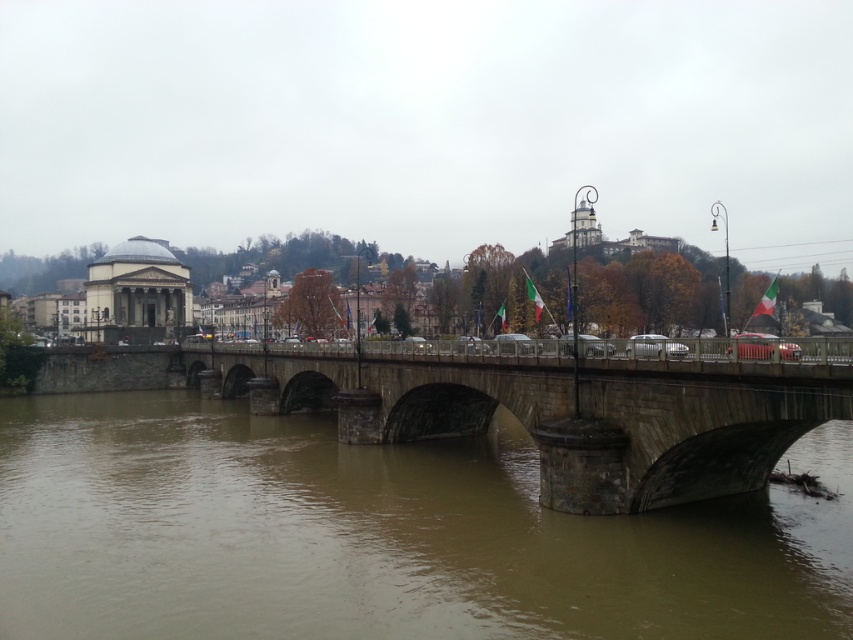
Consider the image. Is brown stone river at center positioned before stone bridge at center?

Yes.

Can you confirm if brown stone river at center is taller than stone bridge at center?

No.

Which is in front, point (165, 625) or point (642, 380)?

Point (165, 625) is in front.

Where is `brown stone river at center`? Image resolution: width=853 pixels, height=640 pixels. brown stone river at center is located at coordinates pos(381,536).